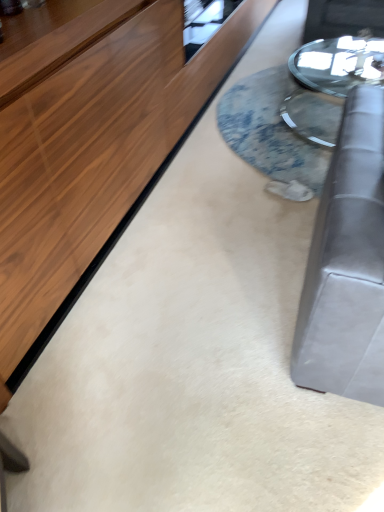
Question: Which direction should I rotate to face translucent glass table at center, marked as the 1th table in a left-to-right arrangement, — up or down?

Choices:
 (A) up
 (B) down

Answer: (A)

Question: From a real-world perspective, is clear glass table at center, which ranks as the second table in left-to-right order, positioned under translucent glass table at center, which appears as the second table when viewed from the right, based on gravity?

Choices:
 (A) no
 (B) yes

Answer: (A)

Question: From the image's perspective, is clear glass table at center, which ranks as the second table in left-to-right order, over translucent glass table at center, which appears as the second table when viewed from the right?

Choices:
 (A) yes
 (B) no

Answer: (A)

Question: Is clear glass table at center, the first table when ordered from right to left, positioned far away from translucent glass table at center, marked as the 1th table in a left-to-right arrangement?

Choices:
 (A) yes
 (B) no

Answer: (B)

Question: Is translucent glass table at center, which appears as the second table when viewed from the right, located within clear glass table at center, which ranks as the second table in left-to-right order?

Choices:
 (A) yes
 (B) no

Answer: (B)

Question: Can you confirm if clear glass table at center, which ranks as the second table in left-to-right order, is wider than translucent glass table at center, which appears as the second table when viewed from the right?

Choices:
 (A) yes
 (B) no

Answer: (B)

Question: Does clear glass table at center, the first table when ordered from right to left, have a greater height compared to translucent glass table at center, marked as the 1th table in a left-to-right arrangement?

Choices:
 (A) yes
 (B) no

Answer: (A)

Question: Is translucent glass table at center, marked as the 1th table in a left-to-right arrangement, positioned before clear glass table at center, which ranks as the second table in left-to-right order?

Choices:
 (A) no
 (B) yes

Answer: (B)

Question: Is translucent glass table at center, marked as the 1th table in a left-to-right arrangement, not near clear glass table at center, which ranks as the second table in left-to-right order?

Choices:
 (A) yes
 (B) no

Answer: (B)

Question: Does translucent glass table at center, which appears as the second table when viewed from the right, appear on the left side of clear glass table at center, which ranks as the second table in left-to-right order?

Choices:
 (A) no
 (B) yes

Answer: (B)

Question: Is clear glass table at center, which ranks as the second table in left-to-right order, located within translucent glass table at center, marked as the 1th table in a left-to-right arrangement?

Choices:
 (A) no
 (B) yes

Answer: (A)

Question: Does translucent glass table at center, marked as the 1th table in a left-to-right arrangement, have a greater height compared to clear glass table at center, the first table when ordered from right to left?

Choices:
 (A) yes
 (B) no

Answer: (B)

Question: From a real-world perspective, does translucent glass table at center, which appears as the second table when viewed from the right, sit lower than clear glass table at center, which ranks as the second table in left-to-right order?

Choices:
 (A) no
 (B) yes

Answer: (B)

Question: Is point (258, 157) positioned closer to the camera than point (311, 118)?

Choices:
 (A) closer
 (B) farther

Answer: (A)